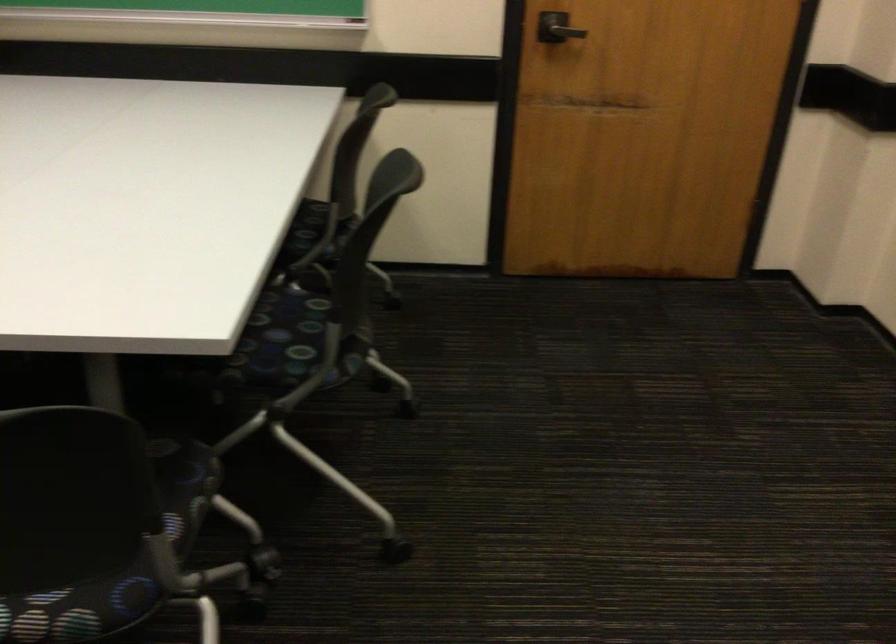
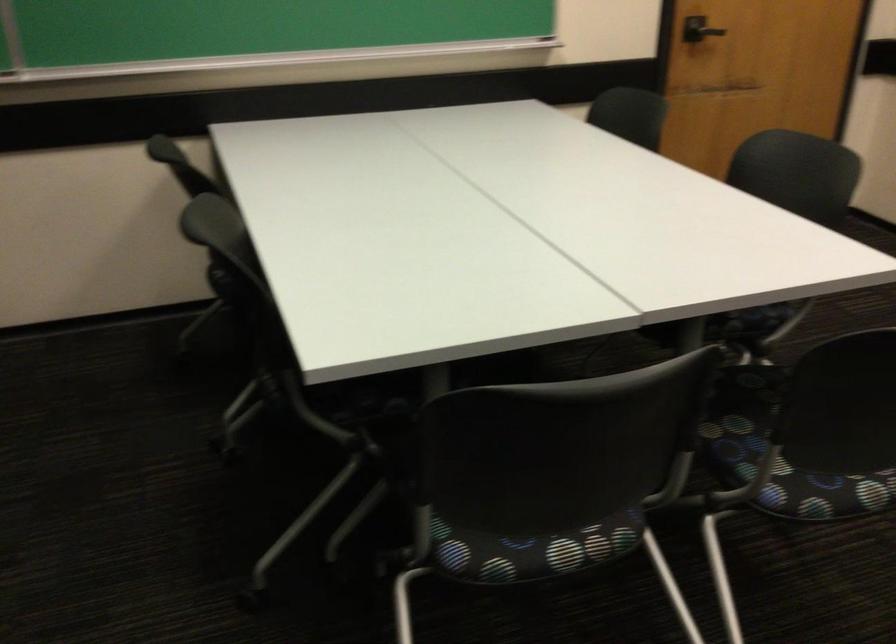
Question: What movement of the cameraman would produce the second image?

Choices:
 (A) Left
 (B) Right
 (C) Forward
 (D) Backward

Answer: (A)